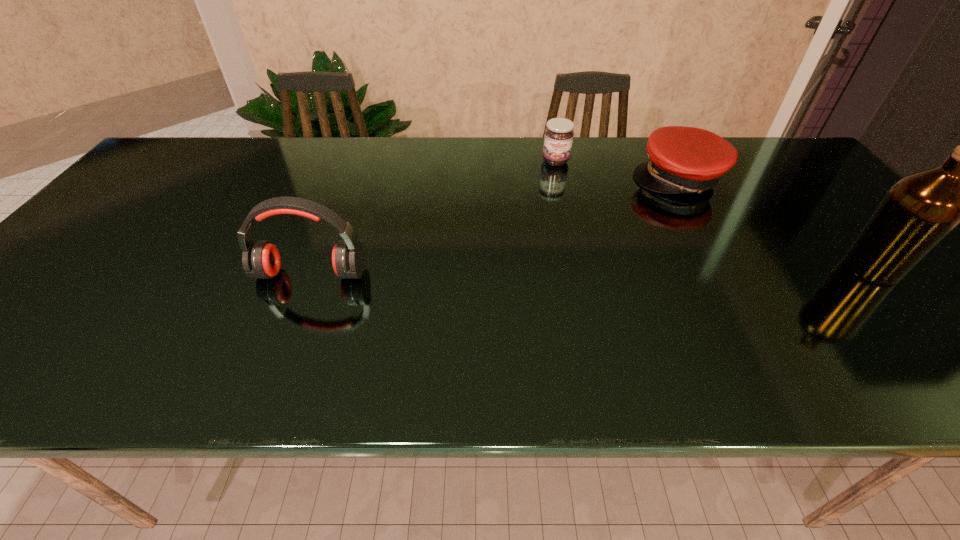
This screenshot has width=960, height=540. I want to click on object that is the third closest to the jam, so click(917, 212).

Select which object is the second closest to the second object from left to right. Please provide its 2D coordinates. Your answer should be formatted as a tuple, i.e. [(x, y)], where the tuple contains the x and y coordinates of a point satisfying the conditions above.

[(261, 260)]

You are a GUI agent. You are given a task and a screenshot of the screen. Output one action in this format:
    pyautogui.click(x=<x>, y=<y>)
    Task: Click on the free location that satisfies the following two spatial constraints: 1. on the front side of the second object from left to right; 2. on the label of the tallest object
    
    Given the screenshot: What is the action you would take?
    pyautogui.click(x=581, y=268)